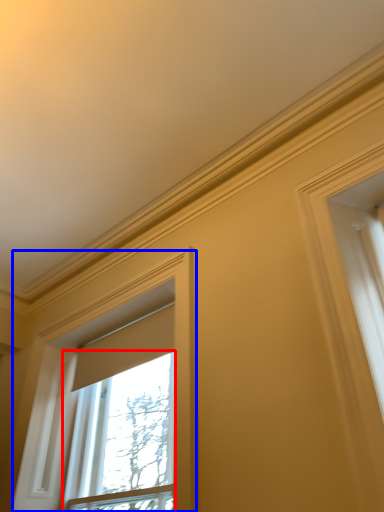
Question: Among these objects, which one is farthest to the camera, window (highlighted by a red box) or window (highlighted by a blue box)?

Choices:
 (A) window
 (B) window

Answer: (A)